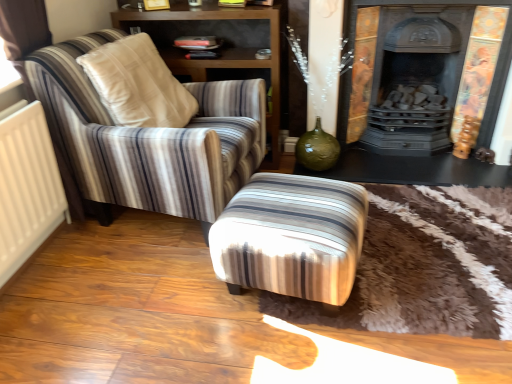
Question: From the image's perspective, is white matte radiator at left positioned above or below striped fabric ottoman at center?

Choices:
 (A) below
 (B) above

Answer: (B)

Question: Does point (39, 208) appear closer or farther from the camera than point (280, 203)?

Choices:
 (A) farther
 (B) closer

Answer: (A)

Question: Based on their relative distances, which object is nearer to the black glossy table at lower right?

Choices:
 (A) wooden shelf at upper left
 (B) dark gray cast iron fireplace at upper right
 (C) white matte radiator at left
 (D) striped fabric ottoman at center
 (E) striped fabric armchair at left

Answer: (B)

Question: Based on their relative distances, which object is farther from the dark gray cast iron fireplace at upper right?

Choices:
 (A) striped fabric armchair at left
 (B) wooden shelf at upper left
 (C) black glossy table at lower right
 (D) white matte radiator at left
 (E) striped fabric ottoman at center

Answer: (D)